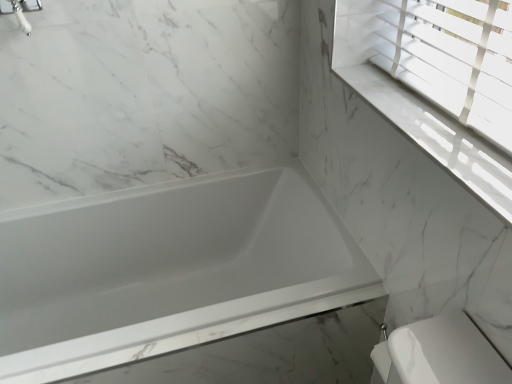
Question: Does silver metallic faucet at upper left appear on the left side of white marble window sill at upper right?

Choices:
 (A) no
 (B) yes

Answer: (B)

Question: Are silver metallic faucet at upper left and white marble window sill at upper right far apart?

Choices:
 (A) yes
 (B) no

Answer: (A)

Question: Can you confirm if silver metallic faucet at upper left is shorter than white marble window sill at upper right?

Choices:
 (A) yes
 (B) no

Answer: (B)

Question: Is silver metallic faucet at upper left facing towards white marble window sill at upper right?

Choices:
 (A) no
 (B) yes

Answer: (A)

Question: Is silver metallic faucet at upper left with white marble window sill at upper right?

Choices:
 (A) no
 (B) yes

Answer: (A)

Question: Is silver metallic faucet at upper left positioned behind white marble window sill at upper right?

Choices:
 (A) no
 (B) yes

Answer: (B)

Question: Is silver metallic faucet at upper left wider than white glossy bathtub at center?

Choices:
 (A) yes
 (B) no

Answer: (B)

Question: Is silver metallic faucet at upper left aimed at white glossy bathtub at center?

Choices:
 (A) yes
 (B) no

Answer: (B)

Question: Is silver metallic faucet at upper left looking in the opposite direction of white glossy bathtub at center?

Choices:
 (A) no
 (B) yes

Answer: (A)

Question: Is silver metallic faucet at upper left beside white glossy bathtub at center?

Choices:
 (A) yes
 (B) no

Answer: (B)

Question: Could white glossy bathtub at center be considered to be inside silver metallic faucet at upper left?

Choices:
 (A) no
 (B) yes

Answer: (A)

Question: Can you confirm if silver metallic faucet at upper left is smaller than white glossy bathtub at center?

Choices:
 (A) no
 (B) yes

Answer: (B)

Question: From a real-world perspective, is white glossy bathtub at center positioned over white marble window sill at upper right based on gravity?

Choices:
 (A) no
 (B) yes

Answer: (A)